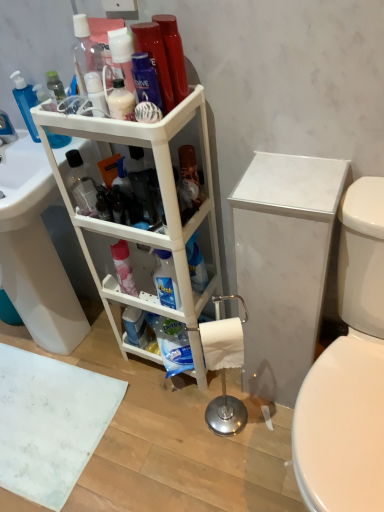
Find the location of `free space in front of white paper towel at center`. free space in front of white paper towel at center is located at coordinates (235, 473).